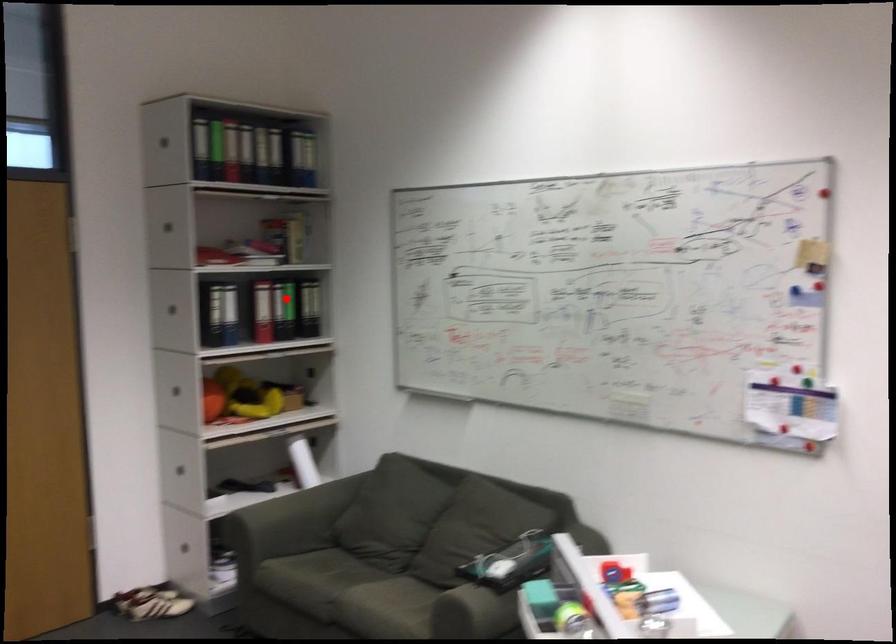
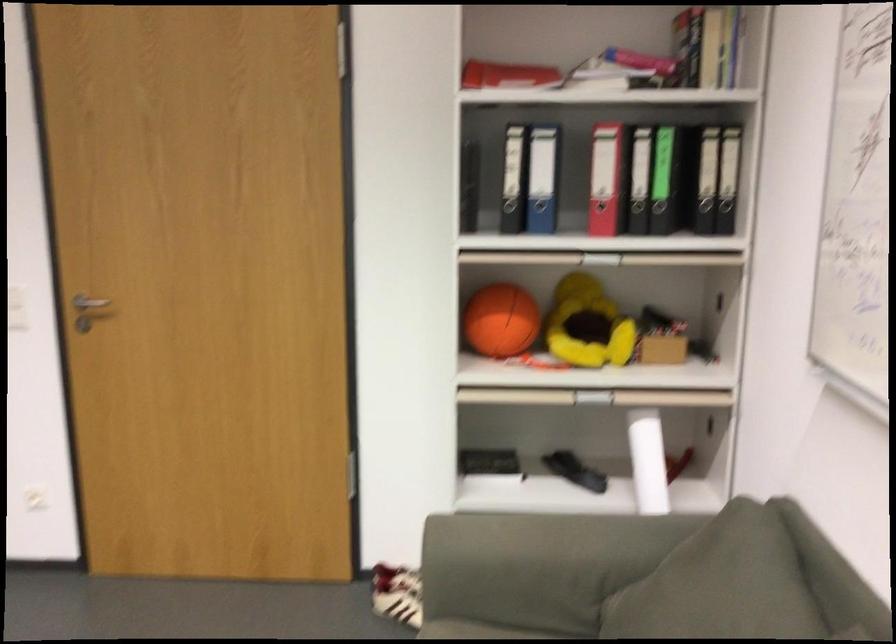
The point at the highlighted location is marked in the first image. Where is the corresponding point in the second image?

(662, 140)